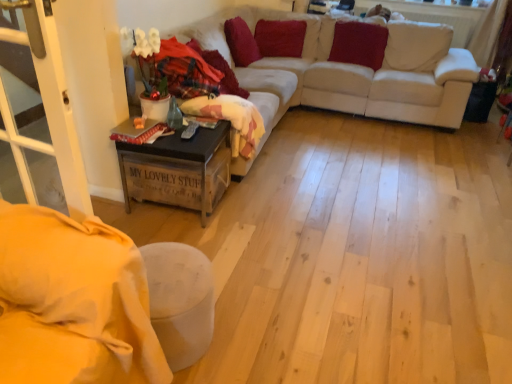
Question: Is white plastic screen door at lower left inside or outside of velvet red pillow at upper center, the 2th pillow positioned from the left?

Choices:
 (A) inside
 (B) outside

Answer: (B)

Question: Relative to velvet red pillow at upper center, the 2th pillow positioned from the left, is white plastic screen door at lower left in front or behind?

Choices:
 (A) behind
 (B) front

Answer: (B)

Question: Considering the real-world distances, which object is farthest from the fluffy pink blanket at center?

Choices:
 (A) white fabric couch at upper center
 (B) velvet red pillow at upper right, the 3th pillow in the left-to-right sequence
 (C) velvet red pillow at upper center, which ranks as the second pillow in right-to-left order
 (D) wooden crate at lower left
 (E) velvet red pillow at upper center, which is the 1th pillow in left-to-right order

Answer: (B)

Question: Considering the real-world distances, which object is farthest from the fluffy pink blanket at center?

Choices:
 (A) velvet red pillow at upper center, the 2th pillow positioned from the left
 (B) white plastic screen door at lower left
 (C) velvet red pillow at upper right, the 3th pillow in the left-to-right sequence
 (D) white fabric couch at upper center
 (E) wooden crate at lower left

Answer: (C)